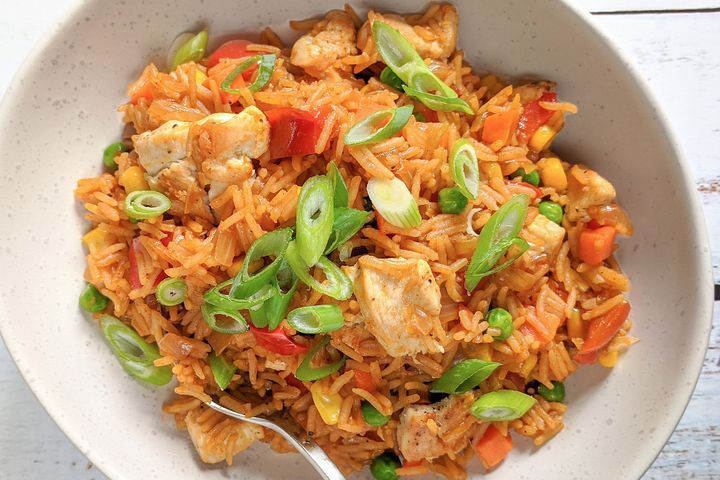
Locate an element on the screen. This screenshot has width=720, height=480. plate is located at coordinates click(94, 423).